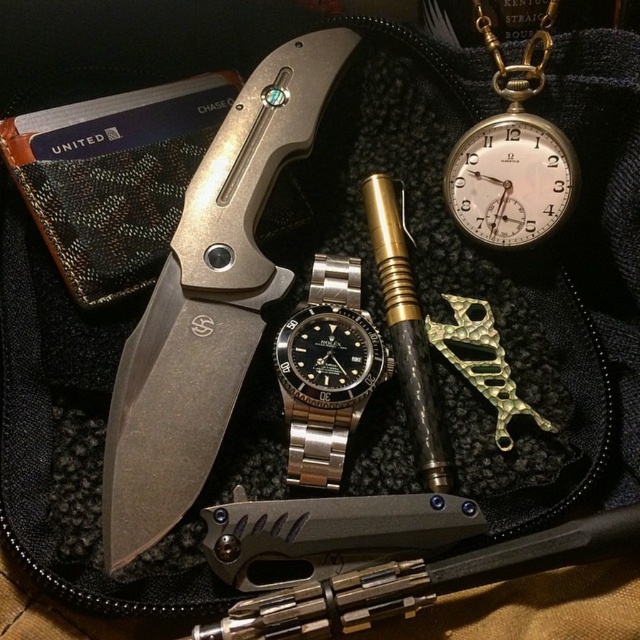
From the picture: You are trying to locate the point at coordinates [208,301] on the image. Which object is this point located on?

The point at coordinates [208,301] is located on the matte silver knife at upper left.